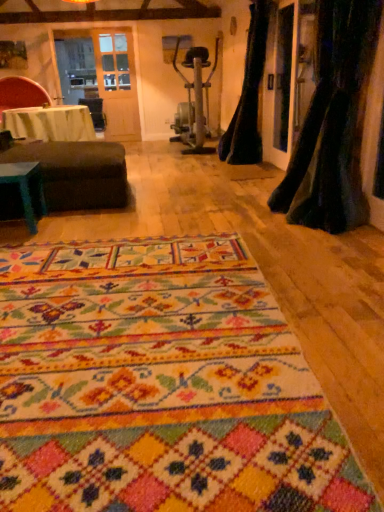
Question: Visually, is black velvet curtain at right, which is counted as the first curtain, starting from the front, positioned to the left or to the right of dark brown fabric ottoman at left?

Choices:
 (A) right
 (B) left

Answer: (A)

Question: Is black velvet curtain at right, which is the second curtain from back to front, wider or thinner than dark brown fabric ottoman at left?

Choices:
 (A) wide
 (B) thin

Answer: (B)

Question: Based on their relative distances, which object is farther from the dark brown fabric ottoman at left?

Choices:
 (A) multicolored woven rug at center
 (B) green felt table at left, arranged as the 1th table when ordered from the bottom
 (C) velvet black curtain at right, which is the 2th curtain from front to back
 (D) white cloth-covered table at left, acting as the 2th table starting from the front
 (E) black velvet curtain at right, which is counted as the first curtain, starting from the front

Answer: (C)

Question: Which of these objects is positioned closest to the multicolored woven rug at center?

Choices:
 (A) velvet black curtain at right, which is the 2th curtain from front to back
 (B) white cloth-covered table at left, acting as the 2th table starting from the front
 (C) green felt table at left, which ranks as the second table in top-to-bottom order
 (D) velvet red chair at upper left
 (E) black velvet curtain at right, which is the second curtain from back to front

Answer: (E)